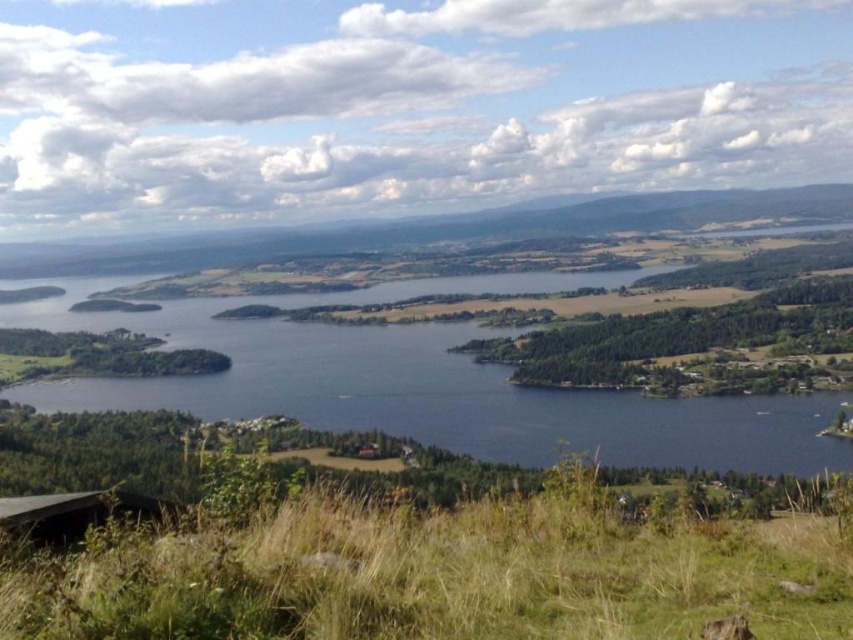
From the picture: Can you confirm if green grassy at lower center is positioned below blue water at center?

Yes, green grassy at lower center is below blue water at center.

Does green grassy at lower center have a smaller size compared to blue water at center?

Yes, green grassy at lower center is smaller than blue water at center.

Who is more distant from viewer, (45,605) or (718,397)?

Positioned behind is point (718,397).

Locate an element on the screen. This screenshot has width=853, height=640. green grassy at lower center is located at coordinates (445, 573).